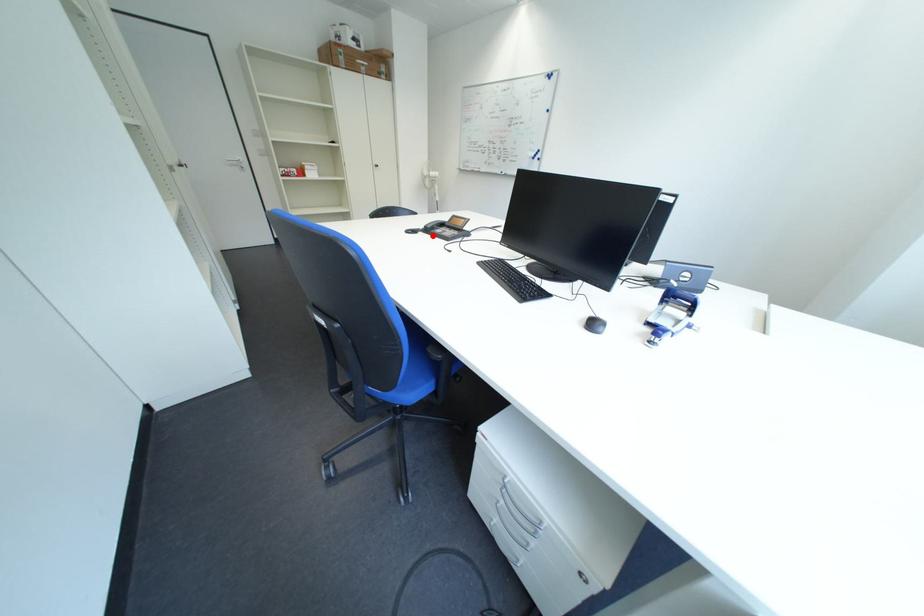
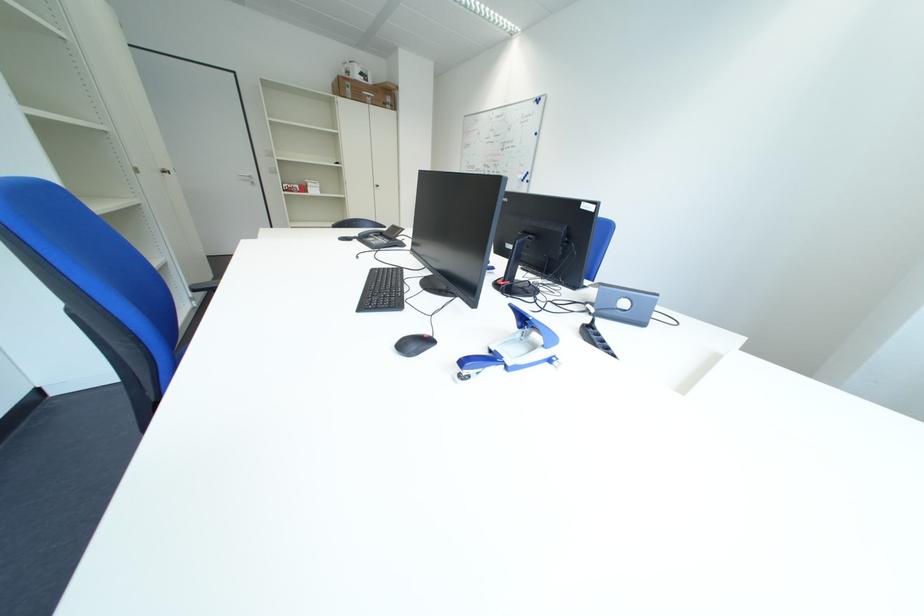
Locate, in the second image, the point that corresponds to the highlighted location in the first image.

(368, 244)